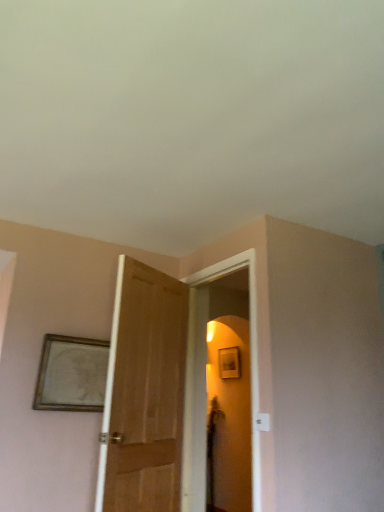
Question: Relative to matte wooden screen door at center, is wooden framed drawing at upper left in front or behind?

Choices:
 (A) behind
 (B) front

Answer: (A)

Question: In terms of height, does wooden framed drawing at upper left look taller or shorter compared to matte wooden screen door at center?

Choices:
 (A) short
 (B) tall

Answer: (A)

Question: Choose the correct answer: Is wooden framed drawing at upper left inside matte wooden screen door at center or outside it?

Choices:
 (A) outside
 (B) inside

Answer: (A)

Question: Is matte wooden screen door at center taller or shorter than wooden framed drawing at upper left?

Choices:
 (A) tall
 (B) short

Answer: (A)

Question: In the image, is matte wooden screen door at center positioned in front of or behind wooden framed drawing at upper left?

Choices:
 (A) front
 (B) behind

Answer: (A)

Question: From the image's perspective, is matte wooden screen door at center positioned above or below wooden framed drawing at upper left?

Choices:
 (A) below
 (B) above

Answer: (A)

Question: Based on their sizes in the image, would you say matte wooden screen door at center is bigger or smaller than wooden framed drawing at upper left?

Choices:
 (A) big
 (B) small

Answer: (A)